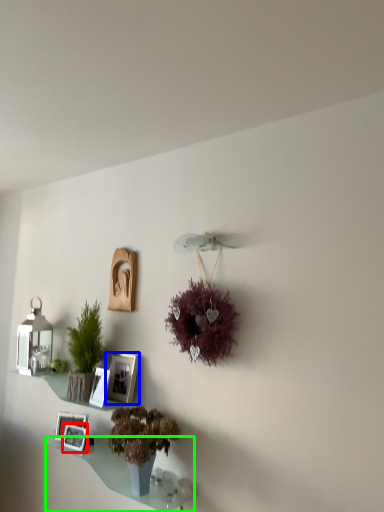
Question: Based on their relative distances, which object is nearer to picture frame (highlighted by a red box)? Choose from picture frame (highlighted by a blue box) and window sill (highlighted by a green box).

Choices:
 (A) picture frame
 (B) window sill

Answer: (B)